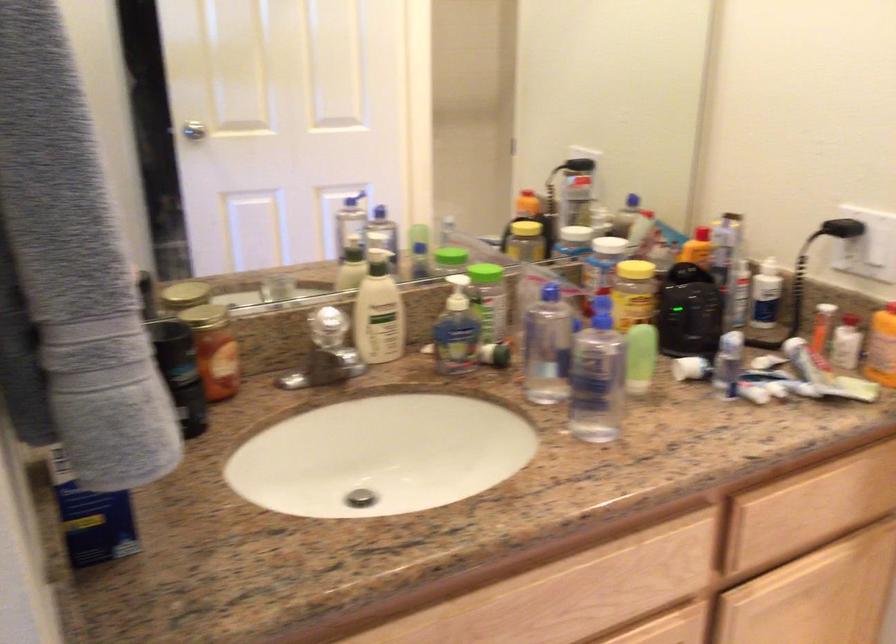
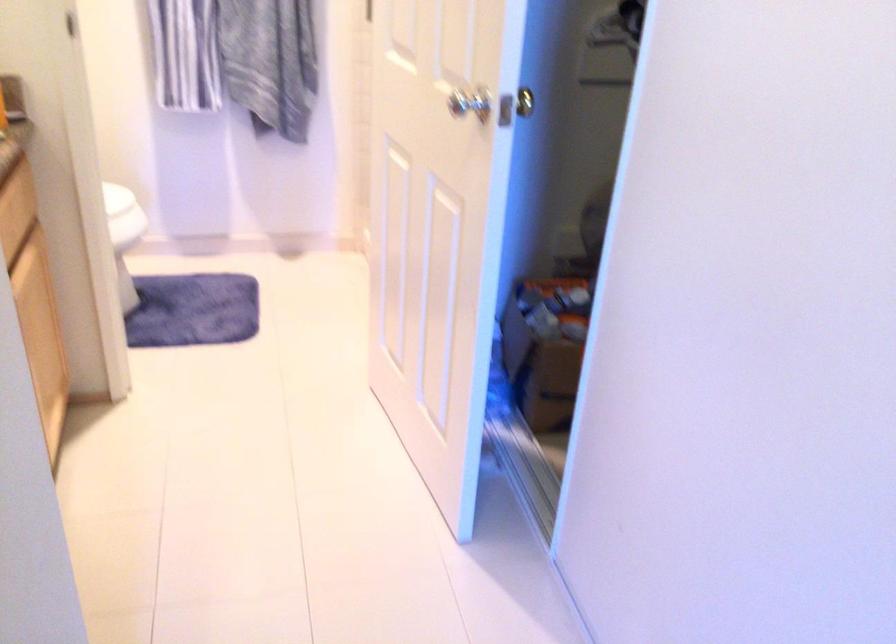
How did the camera likely rotate?

The camera's rotation is toward right-down.